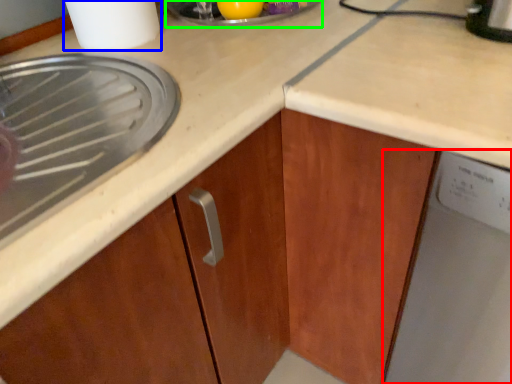
Question: Based on their relative distances, which object is farther from home appliance (highlighted by a red box)? Choose from kitchen appliance (highlighted by a blue box) and appliance (highlighted by a green box).

Choices:
 (A) kitchen appliance
 (B) appliance

Answer: (A)